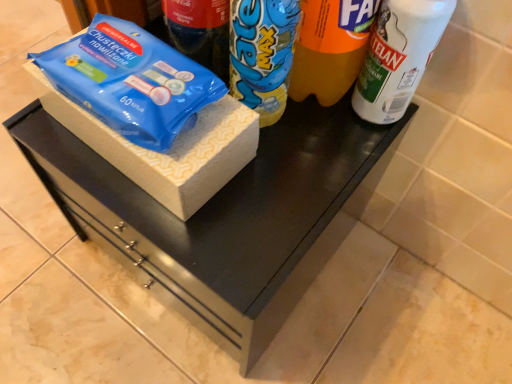
Where is `free space in front of white matte spray can at upper right`? The height and width of the screenshot is (384, 512). free space in front of white matte spray can at upper right is located at coordinates (302, 204).